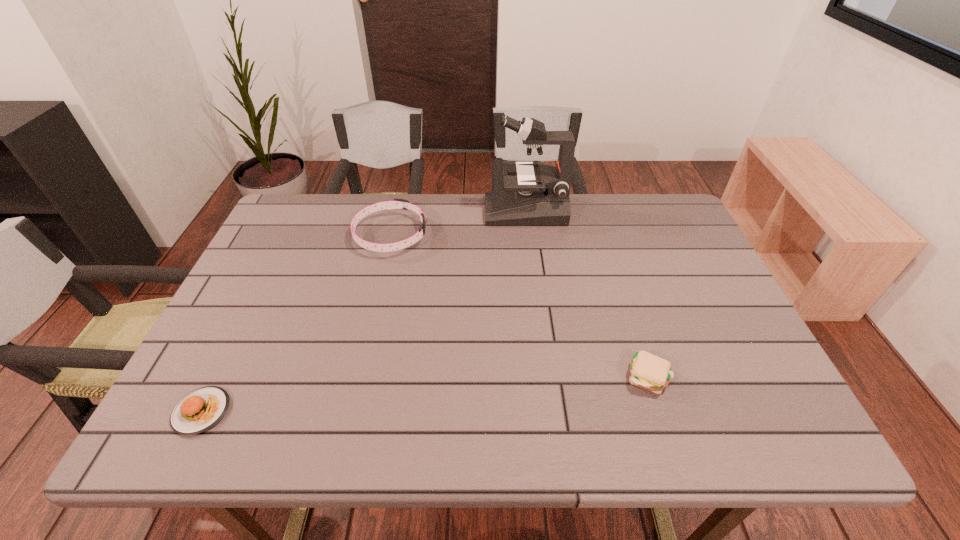
You are a GUI agent. You are given a task and a screenshot of the screen. Output one action in this format:
    pyautogui.click(x=<x>, y=<y>)
    Task: Click on the free spot between the left food and the second object from left to right
    The width and height of the screenshot is (960, 540).
    Given the screenshot: What is the action you would take?
    pyautogui.click(x=297, y=323)

Where is `free area in between the shorter food and the rightmost object`? This screenshot has width=960, height=540. free area in between the shorter food and the rightmost object is located at coordinates (424, 394).

What are the coordinates of `empty space that is in between the third object from right to left and the taller food` in the screenshot? It's located at (519, 306).

The width and height of the screenshot is (960, 540). Find the location of `vacant point located between the second object from left to right and the third object from left to right`. vacant point located between the second object from left to right and the third object from left to right is located at coordinates (458, 223).

Locate an element on the screen. This screenshot has width=960, height=540. empty space between the taller food and the second object from right to left is located at coordinates (587, 294).

What are the coordinates of `object that is the third closest to the third shortest object` in the screenshot? It's located at (647, 371).

Select which object is the closest to the tallest object. Please provide its 2D coordinates. Your answer should be formatted as a tuple, i.e. [(x, y)], where the tuple contains the x and y coordinates of a point satisfying the conditions above.

[(396, 203)]

This screenshot has height=540, width=960. In order to click on free space that satisfies the following two spatial constraints: 1. through the eyepieces of the third object from left to right; 2. on the right side of the right food in this screenshot , I will do `click(546, 377)`.

Where is `vacant space that satisfies the following two spatial constraints: 1. with the buckle on the rightmost object; 2. on the right side of the second tallest object`? The height and width of the screenshot is (540, 960). vacant space that satisfies the following two spatial constraints: 1. with the buckle on the rightmost object; 2. on the right side of the second tallest object is located at coordinates (358, 377).

Where is `vacant region that satisfies the following two spatial constraints: 1. through the eyepieces of the tallest object; 2. on the front side of the shortest object`? The height and width of the screenshot is (540, 960). vacant region that satisfies the following two spatial constraints: 1. through the eyepieces of the tallest object; 2. on the front side of the shortest object is located at coordinates [550, 411].